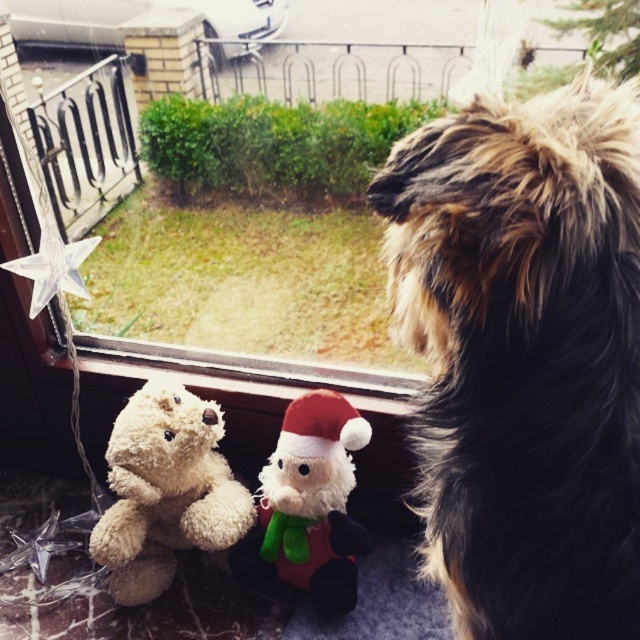
You are a child who wants to grab both the soft beige teddy bear at lower left and the velvety plush santa at center. Which toy can you reach first without moving your position?

The soft beige teddy bear at lower left is closer to you than the velvety plush santa at center, so you can reach it first.

You are a delivery robot that needs to place a small package on the exact spot where the soft beige teddy bear at lower left is located. According to the coordinates provided, what are the coordinates where you should place the package?

The coordinates for the soft beige teddy bear at lower left are at point [164,490], so you should place the package at those coordinates.